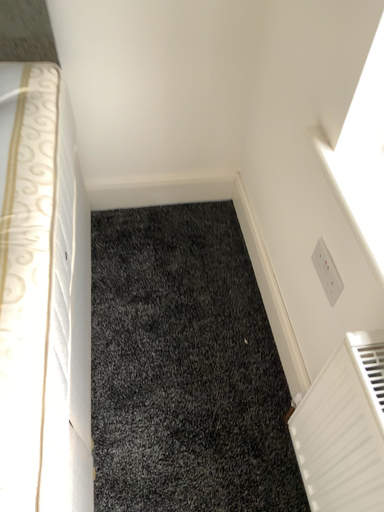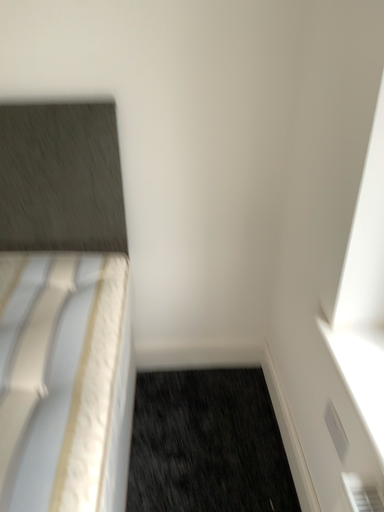
Question: How did the camera likely rotate when shooting the video?

Choices:
 (A) rotated upward
 (B) rotated downward

Answer: (A)